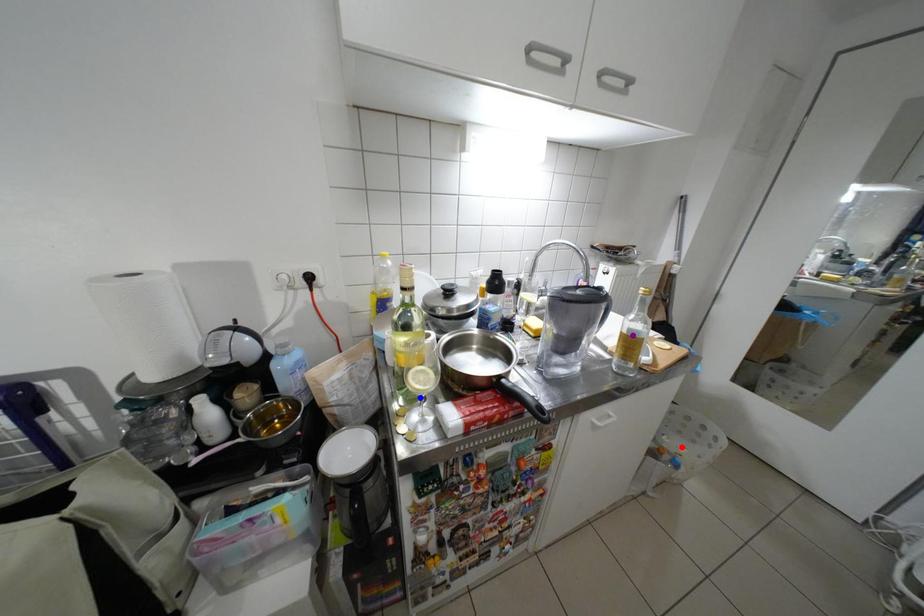
Order these from farthest to nearest:
red point
purple point
blue point

red point → purple point → blue point